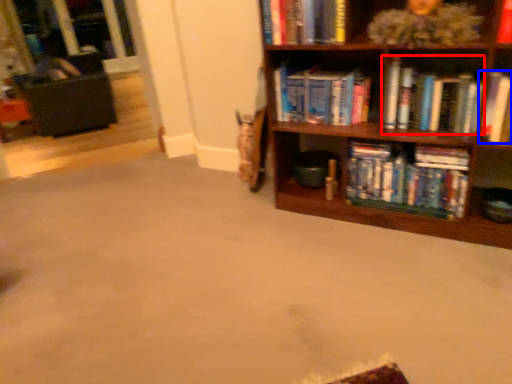
Question: Which of the following is the farthest to the observer, book (highlighted by a red box) or book (highlighted by a blue box)?

Choices:
 (A) book
 (B) book

Answer: (A)